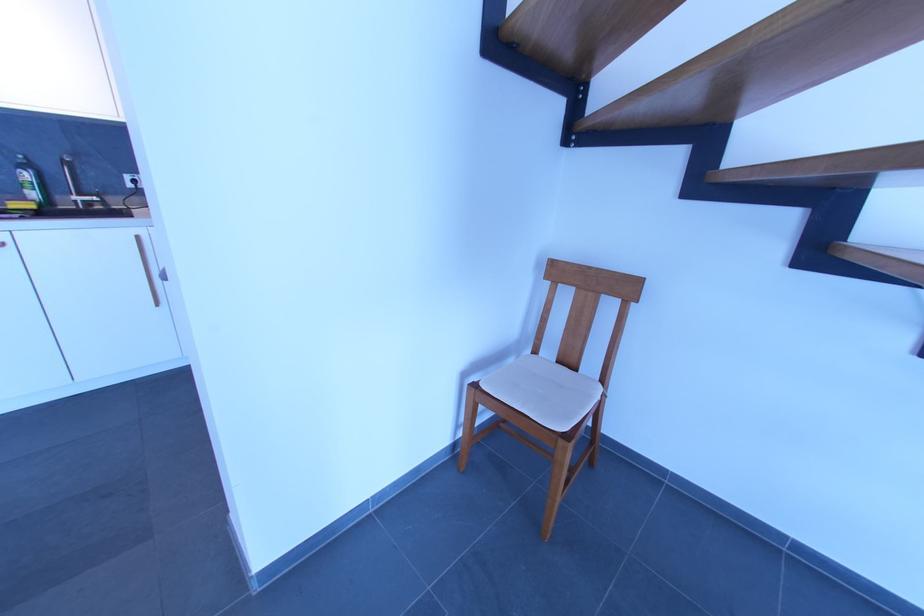
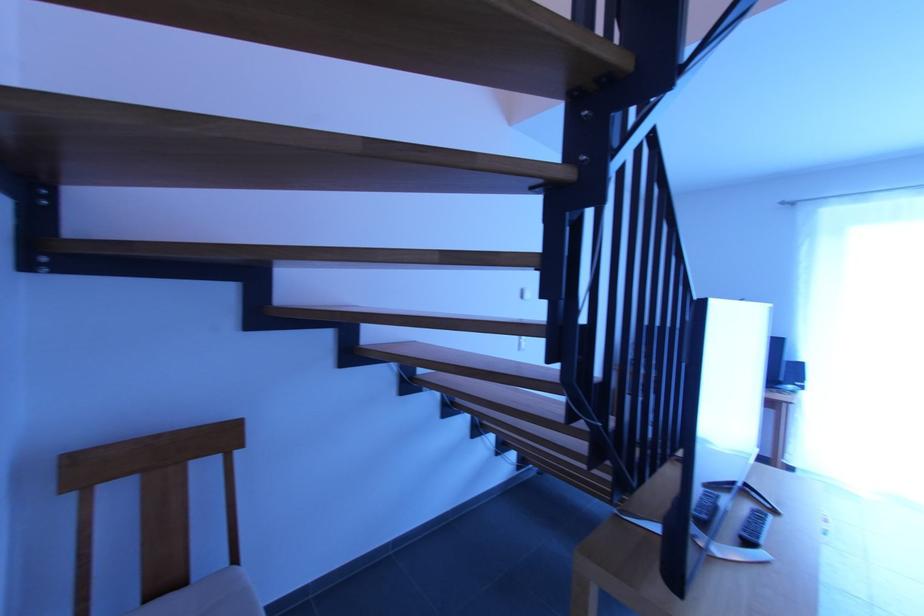
In the second image, find the point that corresponds to point (579, 371) in the first image.

(189, 584)